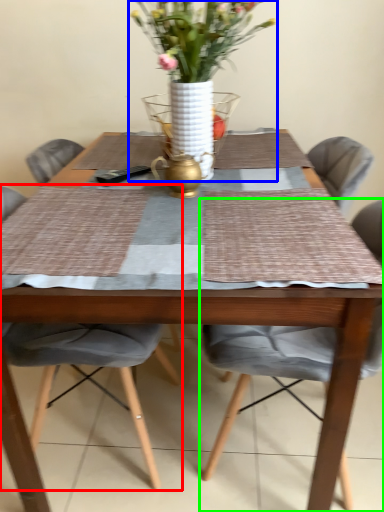
Question: Considering the real-world distances, which object is closest to chair (highlighted by a red box)? houseplant (highlighted by a blue box) or chair (highlighted by a green box).

Choices:
 (A) houseplant
 (B) chair

Answer: (B)